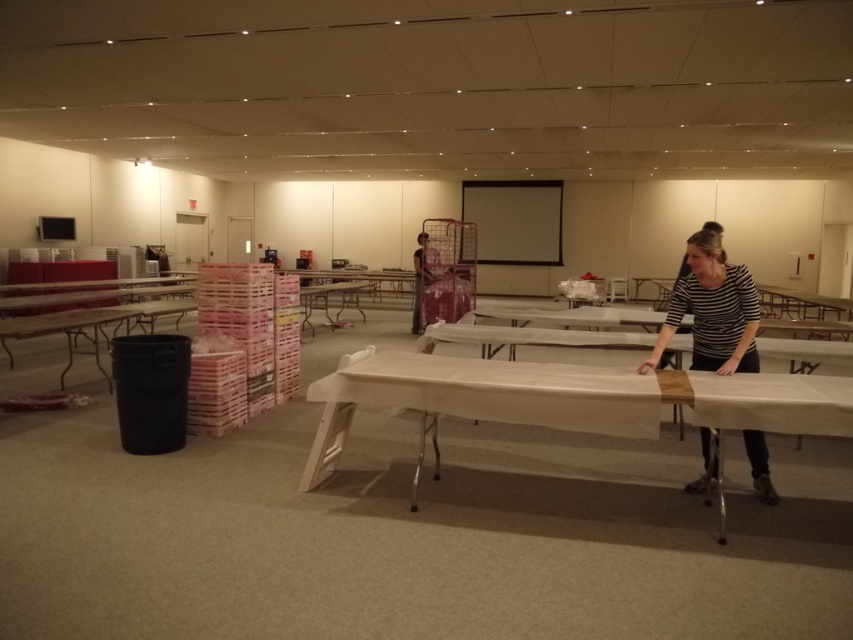
In the scene shown: You are setting up for a presentation and need to position a projector that requires a clear line of sight to the matte black projection screen at center. Given the room layout described, where should you place the projector to ensure it can project onto the screen without obstruction?

The matte black projection screen at center is located at point [514,220]. To ensure a clear line of sight, the projector should be placed in a position that aligns with this coordinate, avoiding any obstructions like tables or people in the foreground.

You are setting up for an event in the room. You have a white plastic table at center and a patterned fabric dress at center. Which object is taller?

The patterned fabric dress at center is taller than the white plastic table at center.

You are organizing an event in the room and need to determine if the patterned fabric dress at center can be placed on the white plastic table at center without falling off. Based on their sizes, is this possible?

The white plastic table at center has a smaller size compared to patterned fabric dress at center, so the dress may not fit entirely on the table and could risk falling off.